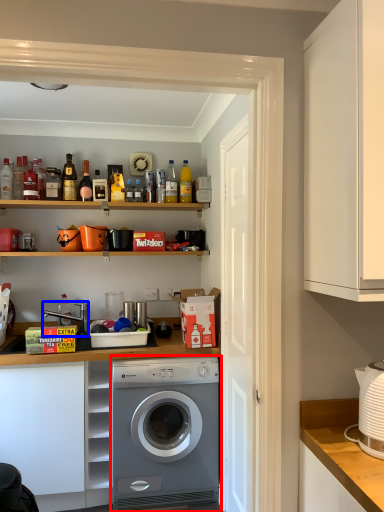
Question: Which object is further to the camera taking this photo, washing machine (highlighted by a red box) or sink (highlighted by a blue box)?

Choices:
 (A) washing machine
 (B) sink

Answer: (B)